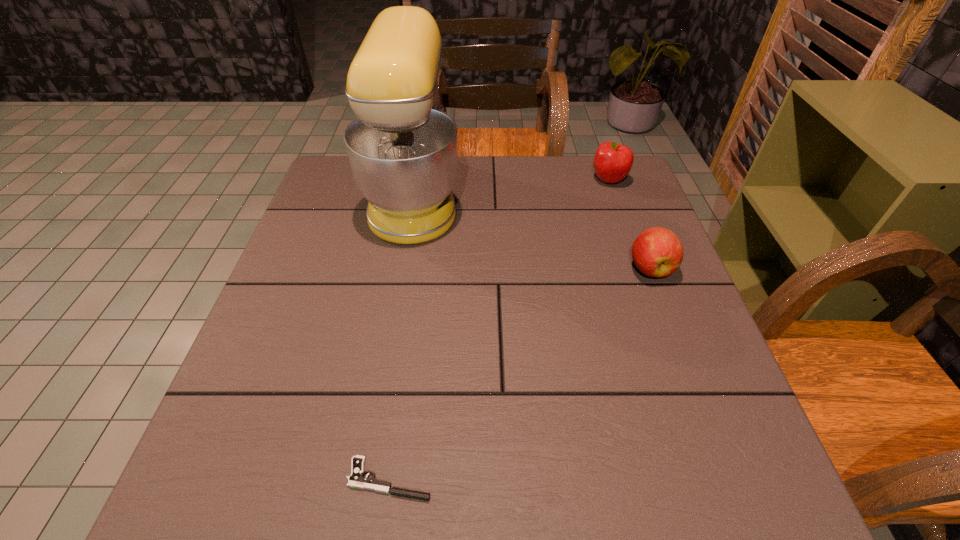
In order to click on mixer in this screenshot , I will do `click(403, 149)`.

The image size is (960, 540). Find the location of `the farther apple`. the farther apple is located at coordinates (612, 162).

Find the location of a particular element. The image size is (960, 540). the nearer apple is located at coordinates (657, 252).

You are a GUI agent. You are given a task and a screenshot of the screen. Output one action in this format:
    pyautogui.click(x=<x>, y=<y>)
    Task: Click on the pistol
    
    Given the screenshot: What is the action you would take?
    pyautogui.click(x=356, y=480)

I want to click on the nearest object, so click(356, 480).

Find the location of a particular element. vacant space located on the side of the tallest object with the control knob is located at coordinates (567, 196).

What are the coordinates of `free region located on the left of the farther apple` in the screenshot? It's located at (528, 180).

At what (x,y) coordinates should I click in order to perform the action: click on vacant area situated on the front of the third farthest object. Please return your answer as a coordinate pair (x, y). Looking at the image, I should click on (683, 354).

Where is `free region located 0.130m on the front-facing side of the nearest object`? The width and height of the screenshot is (960, 540). free region located 0.130m on the front-facing side of the nearest object is located at coordinates (265, 479).

Identify the location of blank space located 0.190m on the front-facing side of the nearest object. (227, 479).